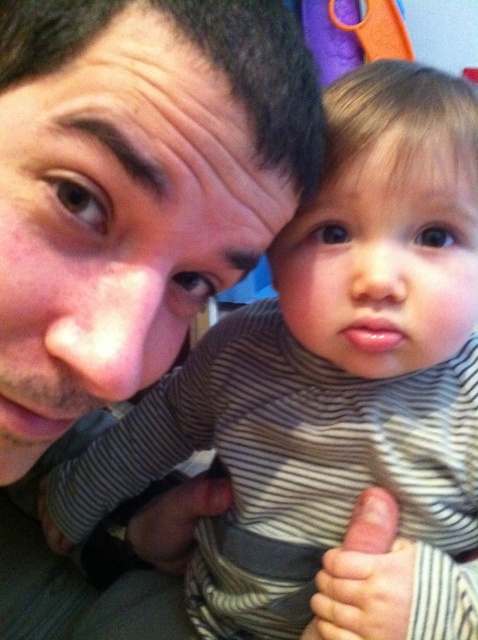
Question: Considering the relative positions of matte skin face at upper left and matte gray thumb at center in the image provided, where is matte skin face at upper left located with respect to matte gray thumb at center?

Choices:
 (A) below
 (B) above

Answer: (B)

Question: Can you confirm if matte skin face at upper left is positioned below matte gray thumb at center?

Choices:
 (A) yes
 (B) no

Answer: (B)

Question: Can you confirm if matte skin face at upper left is positioned below matte gray thumb at center?

Choices:
 (A) no
 (B) yes

Answer: (A)

Question: Which of the following is the farthest from the observer?

Choices:
 (A) (383, 493)
 (B) (159, 250)

Answer: (A)

Question: Which of the following is the closest to the observer?

Choices:
 (A) (299, 120)
 (B) (388, 513)

Answer: (A)

Question: Among these objects, which one is farthest from the camera?

Choices:
 (A) matte gray thumb at center
 (B) matte skin face at upper left

Answer: (A)